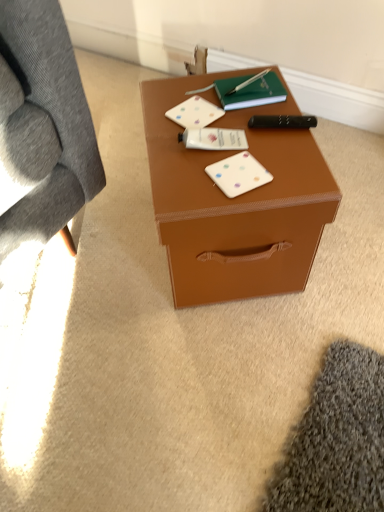
Identify the location of free location in front of green matte notebook at upper center. (259, 137).